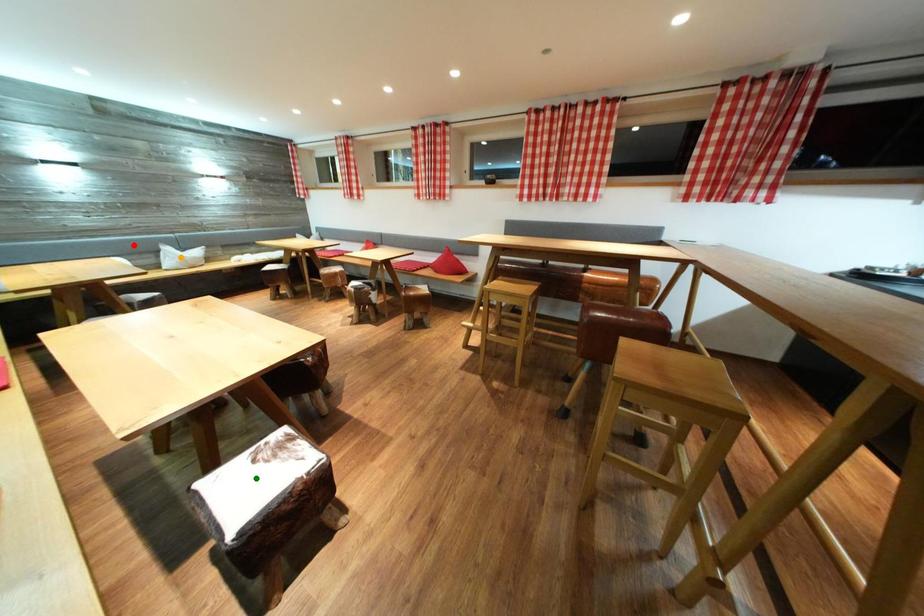
Order these from nearest to farthest:
1. green point
2. red point
3. orange point

Answer: 1. green point
2. red point
3. orange point